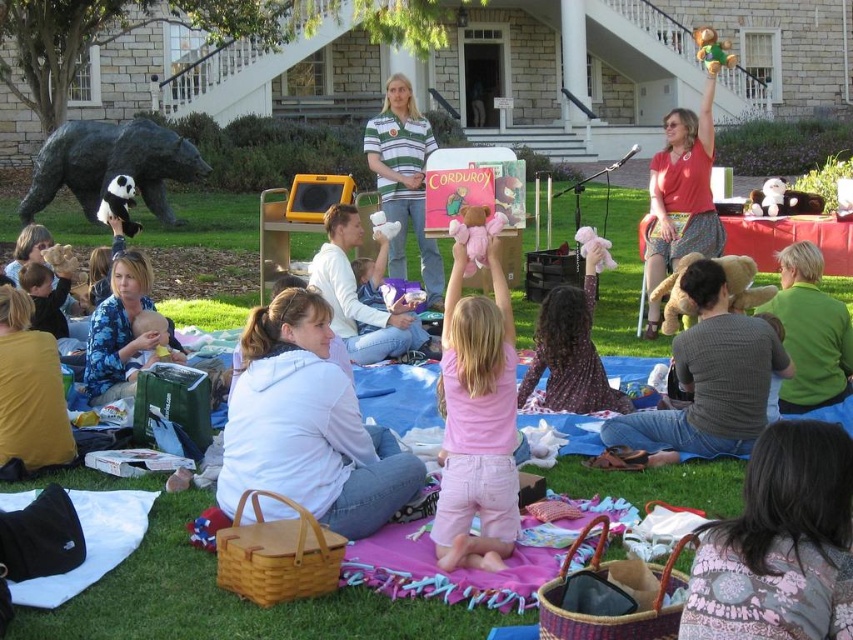
Question: Which point is closer to the camera?

Choices:
 (A) (601, 380)
 (B) (405, 308)

Answer: (A)

Question: Which of the following is the closest to the observer?

Choices:
 (A) (779, 193)
 (B) (703, 51)
 (C) (306, 374)

Answer: (C)

Question: Which object is farther from the camera taking this photo?

Choices:
 (A) matte red blouse at upper right
 (B) knit sweater at center

Answer: (A)

Question: Can you confirm if white fleece hoodie at center is positioned above matte red blouse at upper right?

Choices:
 (A) yes
 (B) no

Answer: (B)

Question: Does pink cotton shirt at center appear on the right side of matte red blouse at upper right?

Choices:
 (A) no
 (B) yes

Answer: (A)

Question: Is patterned fabric shirt at lower right positioned before matte red blouse at upper right?

Choices:
 (A) no
 (B) yes

Answer: (B)